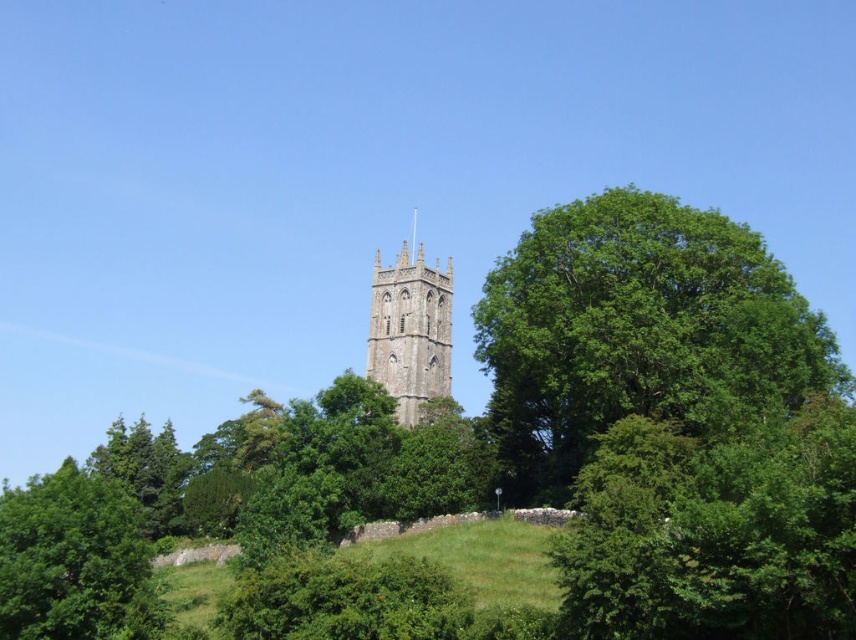
Question: Is green leafy tree at right to the right of stone tower at center from the viewer's perspective?

Choices:
 (A) yes
 (B) no

Answer: (A)

Question: Which point is farther from the camera taking this photo?

Choices:
 (A) (123, 557)
 (B) (438, 304)
 (C) (696, 428)

Answer: (B)

Question: Which point is farther to the camera?

Choices:
 (A) (483, 346)
 (B) (123, 566)

Answer: (A)

Question: Does green leafy tree at lower left have a lesser width compared to stone tower at center?

Choices:
 (A) no
 (B) yes

Answer: (A)

Question: Observing the image, what is the correct spatial positioning of green leafy tree at right in reference to stone tower at center?

Choices:
 (A) left
 (B) right

Answer: (B)

Question: Which object appears closest to the camera in this image?

Choices:
 (A) green leafy tree at right
 (B) stone tower at center

Answer: (A)